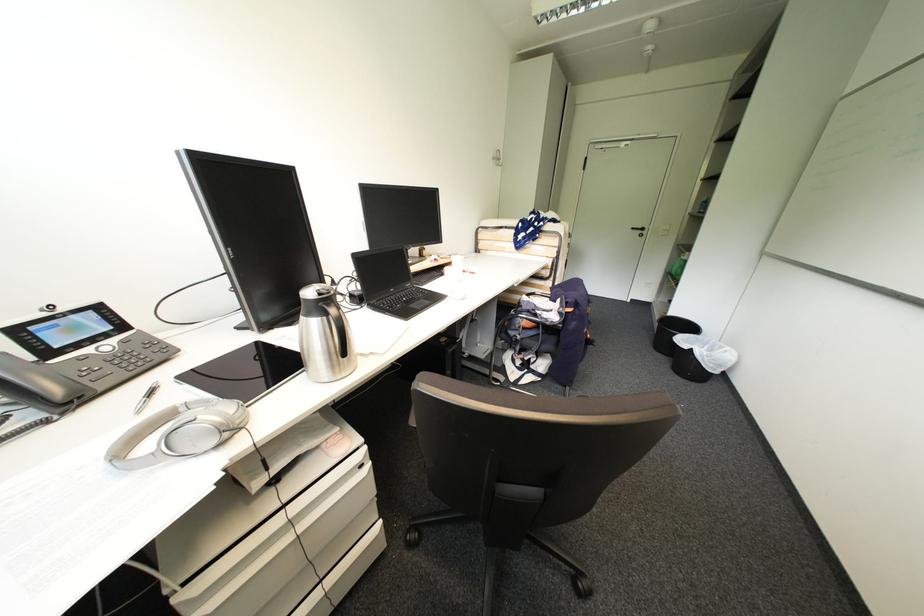
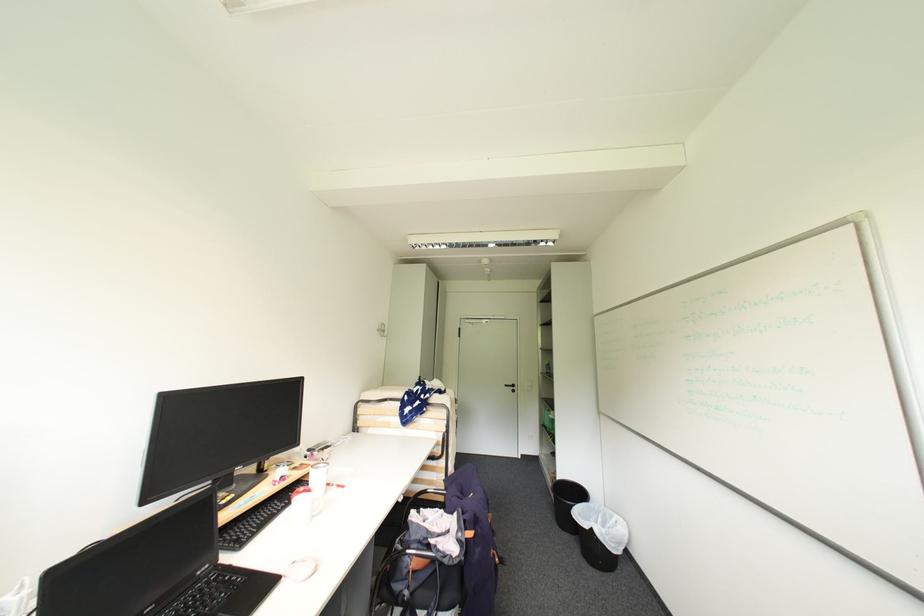
Where in the second image is the point corresponding to point (500, 159) from the first image?

(384, 331)